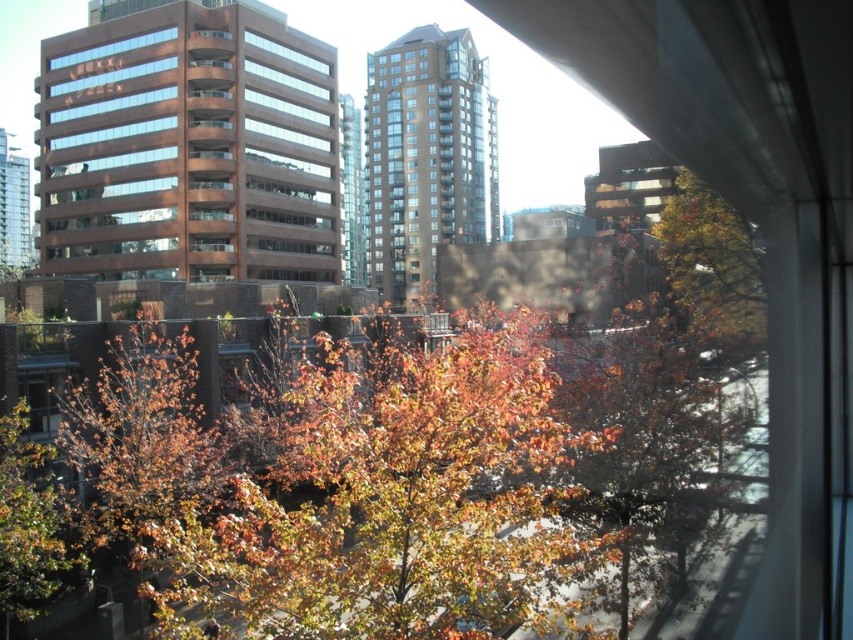
You are standing inside the building looking out the window. You want to take a photo of the autumn leaves at center. Where should you aim your camera to capture them?

You should aim your camera at point (712,262) to capture the autumn leaves at center.

You are standing inside the building looking out the window. You notice an autumn leaves at center and a green leafy tree at lower left. Which object is positioned to the right of the other?

The autumn leaves at center are to the right of the green leafy tree at lower left.